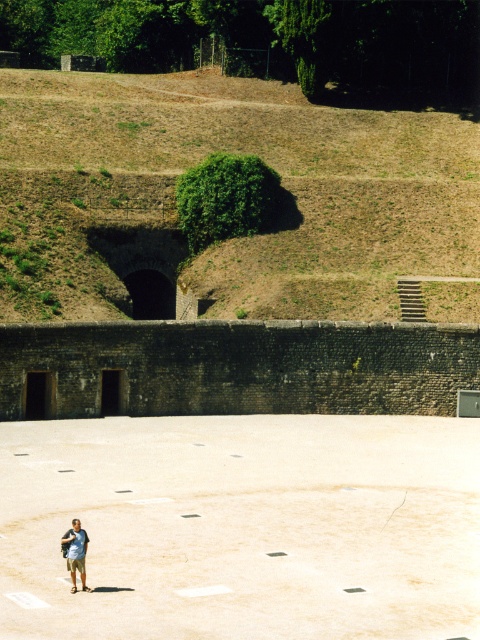
Question: Can you confirm if smooth concrete skate park at center is bigger than light blue cotton shirt at lower left?

Choices:
 (A) yes
 (B) no

Answer: (A)

Question: Which point is closer to the camera?

Choices:
 (A) smooth concrete skate park at center
 (B) light blue cotton shirt at lower left
 (C) brown earthy hillside at upper center

Answer: (A)

Question: In this image, where is brown earthy hillside at upper center located relative to light blue cotton shirt at lower left?

Choices:
 (A) above
 (B) below

Answer: (A)

Question: Observing the image, what is the correct spatial positioning of smooth concrete skate park at center in reference to light blue cotton shirt at lower left?

Choices:
 (A) left
 (B) right

Answer: (B)

Question: Which point is closer to the camera?

Choices:
 (A) brown earthy hillside at upper center
 (B) light blue cotton shirt at lower left

Answer: (B)

Question: Among these points, which one is nearest to the camera?

Choices:
 (A) (70, 563)
 (B) (28, 241)
 (C) (322, 524)

Answer: (A)